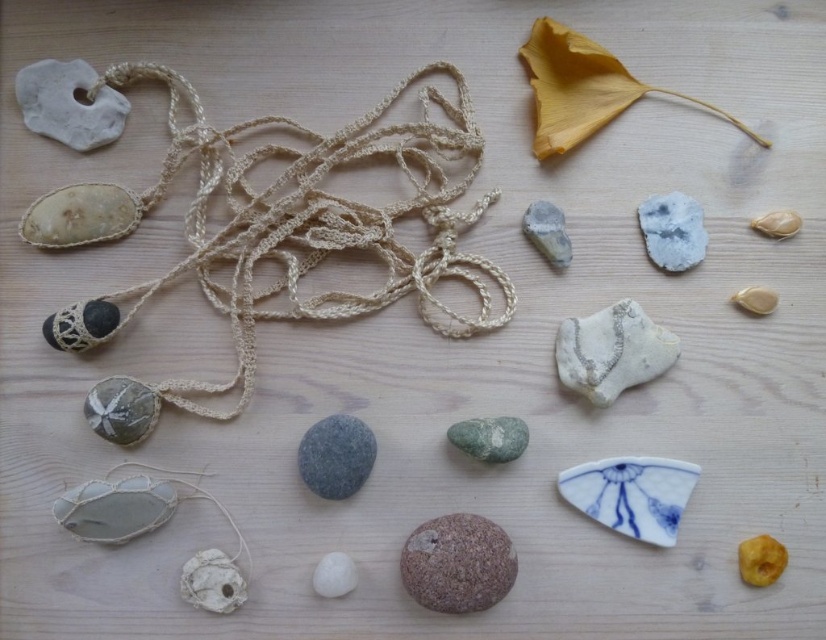
Is gray matte stone at center shorter than translucent amber stone at lower right?

No.

This screenshot has height=640, width=826. Describe the element at coordinates (335, 456) in the screenshot. I see `gray matte stone at center` at that location.

Describe the element at coordinates (335, 456) in the screenshot. I see `gray matte stone at center` at that location.

At what (x,y) coordinates should I click in order to perform the action: click on gray matte stone at center. Please return your answer as a coordinate pair (x, y). Looking at the image, I should click on (335, 456).

Who is lower down, brown rough stone at center or smooth gray stone at center?

Positioned lower is brown rough stone at center.

This screenshot has width=826, height=640. Describe the element at coordinates (457, 563) in the screenshot. I see `brown rough stone at center` at that location.

Describe the element at coordinates (457, 563) in the screenshot. The width and height of the screenshot is (826, 640). I see `brown rough stone at center` at that location.

The height and width of the screenshot is (640, 826). Find the location of `brown rough stone at center`. brown rough stone at center is located at coordinates (457, 563).

This screenshot has height=640, width=826. What do you see at coordinates (121, 410) in the screenshot?
I see `smooth gray stone at center` at bounding box center [121, 410].

Find the location of a particular element. smooth gray stone at center is located at coordinates (121, 410).